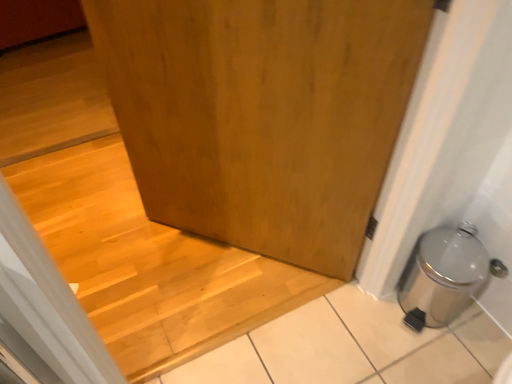
The height and width of the screenshot is (384, 512). What do you see at coordinates (444, 275) in the screenshot? I see `silver metallic trash can at lower right` at bounding box center [444, 275].

The height and width of the screenshot is (384, 512). In order to click on silver metallic trash can at lower right in this screenshot , I will do `click(444, 275)`.

Between wooden door at center and silver metallic trash can at lower right, which one appears on the left side from the viewer's perspective?

Positioned to the left is wooden door at center.

Is wooden door at center inside or outside of silver metallic trash can at lower right?

wooden door at center is not inside silver metallic trash can at lower right, it's outside.

Considering the sizes of objects wooden door at center and silver metallic trash can at lower right in the image provided, who is bigger, wooden door at center or silver metallic trash can at lower right?

wooden door at center is bigger.

Considering the sizes of wooden door at center and silver metallic trash can at lower right in the image, is wooden door at center taller or shorter than silver metallic trash can at lower right?

Clearly, wooden door at center is taller compared to silver metallic trash can at lower right.

Based on their positions, is silver metallic trash can at lower right located to the left or right of wooden at center?

Based on their positions, silver metallic trash can at lower right is located to the right of wooden at center.

From the image's perspective, does silver metallic trash can at lower right appear higher than wooden at center?

Incorrect, from the image's perspective, silver metallic trash can at lower right is lower than wooden at center.

Between point (474, 256) and point (108, 232), which one is positioned behind?

The point (108, 232) is farther from the camera.

Is silver metallic trash can at lower right not near wooden at center?

No.

Identify the location of water heater lying behind the wooden door at center. Image resolution: width=512 pixels, height=384 pixels. (444, 275).

From a real-world perspective, is silver metallic trash can at lower right on top of wooden door at center?

No.

From the image's perspective, is silver metallic trash can at lower right located above wooden door at center?

No, from the image's perspective, silver metallic trash can at lower right is not above wooden door at center.

Is wooden door at center far from wooden at center?

No, there isn't a large distance between wooden door at center and wooden at center.

From the image's perspective, between wooden door at center and wooden at center, which one is located above?

From the image's view, wooden at center is above.

Considering their positions, is wooden door at center located in front of or behind wooden at center?

In the image, wooden door at center appears in front of wooden at center.

From the picture: Who is taller, wooden at center or wooden door at center?

Standing taller between the two is wooden door at center.

Is wooden at center oriented away from wooden door at center?

No.

Is wooden at center at the left side of wooden door at center?

Yes, wooden at center is to the left of wooden door at center.

The image size is (512, 384). In the image, there is a wooden at center. Identify the location of water heater below it (from the image's perspective). (444, 275).

How different are the orientations of wooden at center and silver metallic trash can at lower right in degrees?

The facing directions of wooden at center and silver metallic trash can at lower right are 90.6 degrees apart.

Does wooden at center have a lesser height compared to silver metallic trash can at lower right?

Correct, wooden at center is not as tall as silver metallic trash can at lower right.

Would you say silver metallic trash can at lower right is part of wooden at center's contents?

No, silver metallic trash can at lower right is located outside of wooden at center.

Where is `door lying above the silver metallic trash can at lower right (from the image's perspective)`? The height and width of the screenshot is (384, 512). door lying above the silver metallic trash can at lower right (from the image's perspective) is located at coordinates (262, 114).

You are a GUI agent. You are given a task and a screenshot of the screen. Output one action in this format:
    pyautogui.click(x=<x>, y=<y>)
    Task: Click on the water heater on the right of the wooden at center
    The width and height of the screenshot is (512, 384).
    Given the screenshot: What is the action you would take?
    pyautogui.click(x=444, y=275)

Looking at the image, which one is located closer to wooden at center, silver metallic trash can at lower right or wooden door at center?

Among the two, wooden door at center is located nearer to wooden at center.

When comparing their distances from wooden door at center, does silver metallic trash can at lower right or wooden at center seem further?

Among the two, silver metallic trash can at lower right is located further to wooden door at center.

From the picture: Considering their positions, is wooden door at center positioned closer to wooden at center than silver metallic trash can at lower right?

wooden door at center.

From the image, which object appears to be nearer to wooden door at center, wooden at center or silver metallic trash can at lower right?

wooden at center is positioned closer to the anchor wooden door at center.

Based on their spatial positions, is wooden at center or wooden door at center closer to silver metallic trash can at lower right?

wooden door at center lies closer to silver metallic trash can at lower right than the other object.

Consider the image. Based on their spatial positions, is wooden door at center or wooden at center further from silver metallic trash can at lower right?

The object further to silver metallic trash can at lower right is wooden at center.

The width and height of the screenshot is (512, 384). I want to click on water heater located between wooden door at center and wooden at center in the depth direction, so click(x=444, y=275).